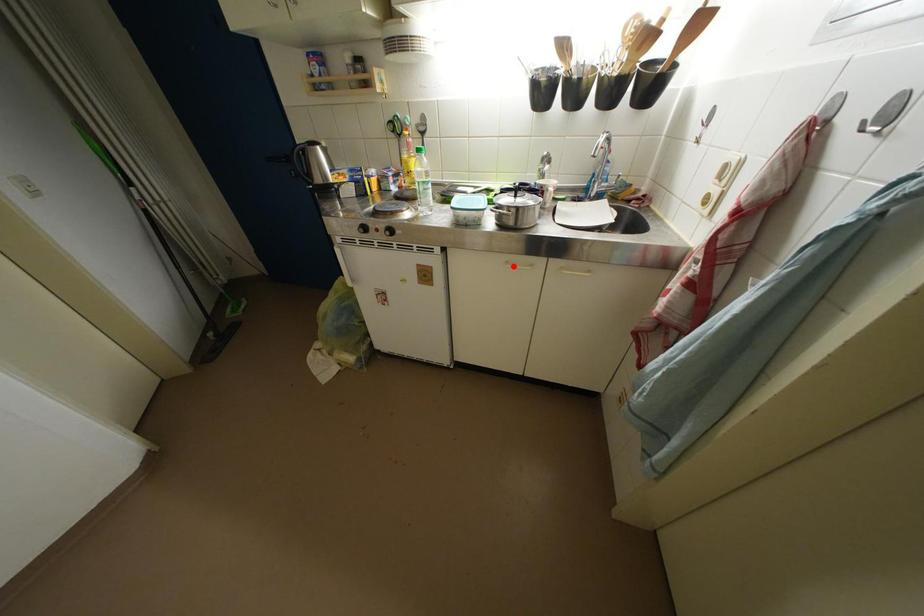
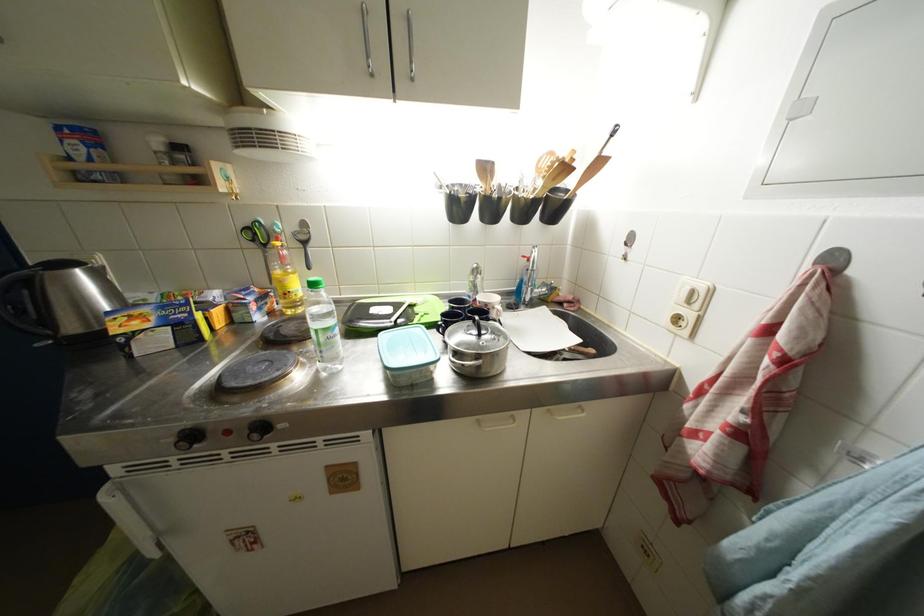
Where in the second image is the point corresponding to the highlighted location from the first image?

(485, 424)